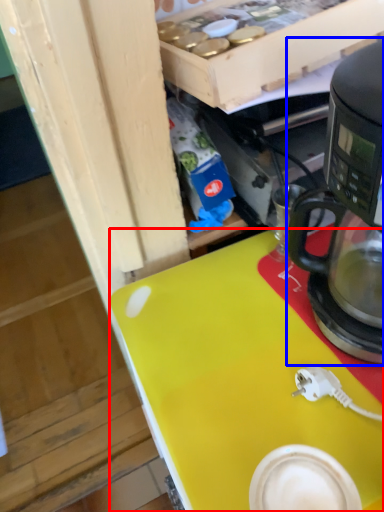
Question: Which point is further to the camera, desk (highlighted by a red box) or coffee maker (highlighted by a blue box)?

Choices:
 (A) desk
 (B) coffee maker

Answer: (A)